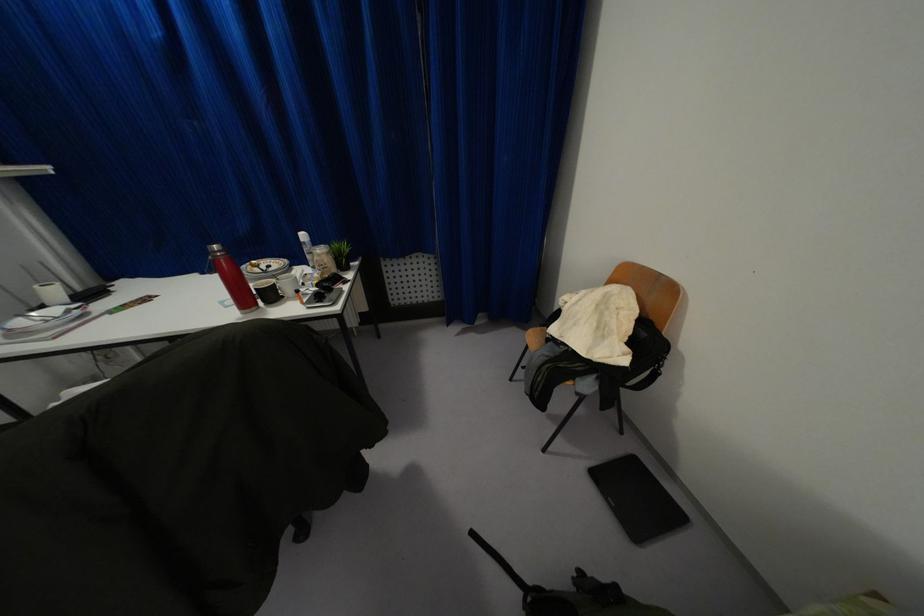
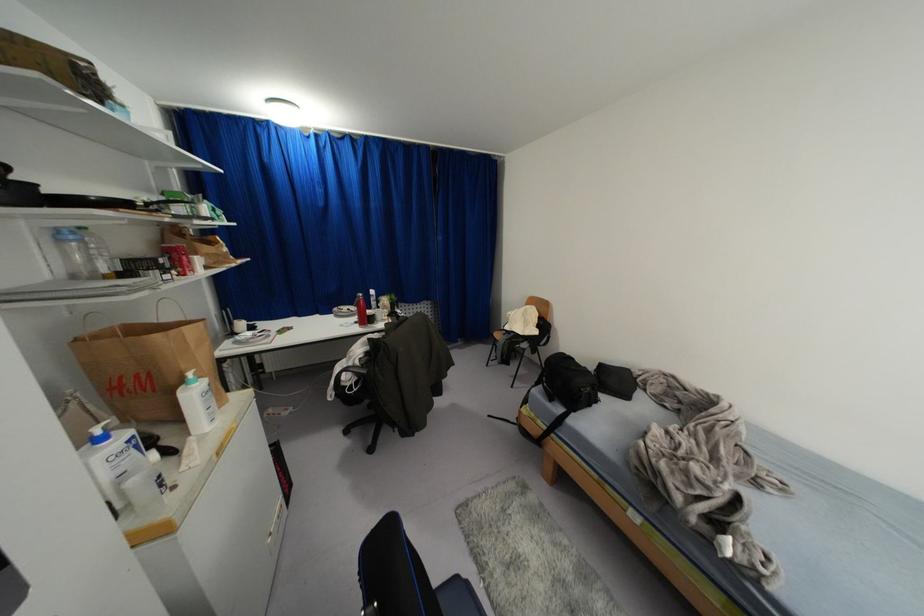
Locate, in the second image, the point that corresponds to (215,262) in the first image.

(359, 301)